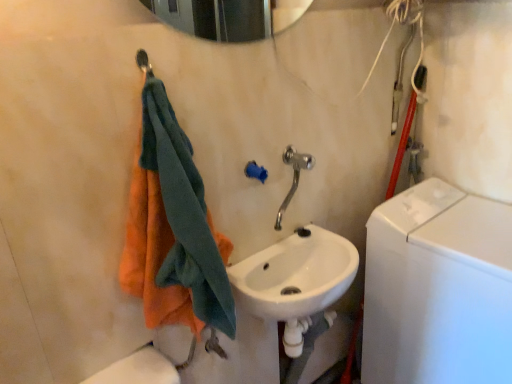
Question: Can you confirm if white glossy washing machine at right is thinner than metallic silver shower at upper left?

Choices:
 (A) yes
 (B) no

Answer: (B)

Question: Is white glossy washing machine at right at the left side of metallic silver shower at upper left?

Choices:
 (A) yes
 (B) no

Answer: (B)

Question: Is white glossy washing machine at right positioned beyond the bounds of metallic silver shower at upper left?

Choices:
 (A) no
 (B) yes

Answer: (B)

Question: Is white glossy washing machine at right positioned far away from metallic silver shower at upper left?

Choices:
 (A) yes
 (B) no

Answer: (A)

Question: From a real-world perspective, is white glossy washing machine at right located higher than metallic silver shower at upper left?

Choices:
 (A) yes
 (B) no

Answer: (B)

Question: From a real-world perspective, relative to polished chrome faucet at center, is orange cotton towel at left vertically above or below?

Choices:
 (A) below
 (B) above

Answer: (B)

Question: Does point (143, 241) appear closer or farther from the camera than point (307, 160)?

Choices:
 (A) closer
 (B) farther

Answer: (A)

Question: Would you say orange cotton towel at left is inside or outside polished chrome faucet at center?

Choices:
 (A) inside
 (B) outside

Answer: (B)

Question: Considering the relative positions of orange cotton towel at left and polished chrome faucet at center in the image provided, is orange cotton towel at left to the left or to the right of polished chrome faucet at center?

Choices:
 (A) left
 (B) right

Answer: (A)

Question: From a real-world perspective, is polished chrome faucet at center above or below metallic silver shower at upper left?

Choices:
 (A) below
 (B) above

Answer: (A)

Question: In the image, is polished chrome faucet at center on the left side or the right side of metallic silver shower at upper left?

Choices:
 (A) left
 (B) right

Answer: (B)

Question: Considering the positions of point (304, 160) and point (145, 67), is point (304, 160) closer or farther from the camera than point (145, 67)?

Choices:
 (A) closer
 (B) farther

Answer: (B)

Question: Considering their positions, is polished chrome faucet at center located in front of or behind metallic silver shower at upper left?

Choices:
 (A) behind
 (B) front

Answer: (A)

Question: From the image's perspective, is white glossy sink at center located above or below orange cotton towel at left?

Choices:
 (A) above
 (B) below

Answer: (B)

Question: In terms of width, does white glossy sink at center look wider or thinner when compared to orange cotton towel at left?

Choices:
 (A) thin
 (B) wide

Answer: (B)